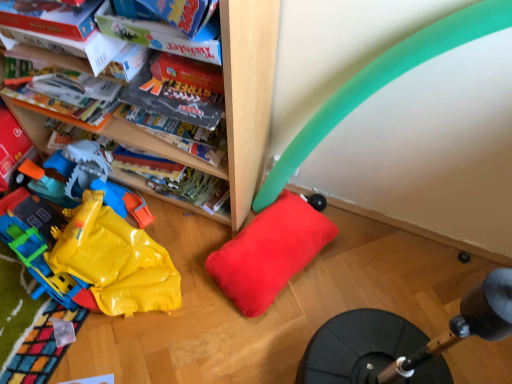
Question: Is yellow plastic bag at lower left behind matte cardboard book at upper left?

Choices:
 (A) yes
 (B) no

Answer: (A)

Question: Are yellow plastic bag at lower left and matte cardboard book at upper left beside each other?

Choices:
 (A) no
 (B) yes

Answer: (A)

Question: From a real-world perspective, is yellow plastic bag at lower left located beneath matte cardboard book at upper left?

Choices:
 (A) no
 (B) yes

Answer: (B)

Question: From the image's perspective, is yellow plastic bag at lower left under matte cardboard book at upper left?

Choices:
 (A) yes
 (B) no

Answer: (A)

Question: Is yellow plastic bag at lower left not within matte cardboard book at upper left?

Choices:
 (A) yes
 (B) no

Answer: (A)

Question: Is yellow plastic bag at lower left not near matte cardboard book at upper left?

Choices:
 (A) no
 (B) yes

Answer: (A)

Question: From the image's perspective, is soft red pillow at center located above yellow plastic bag at lower left?

Choices:
 (A) yes
 (B) no

Answer: (B)

Question: Would you consider soft red pillow at center to be distant from yellow plastic bag at lower left?

Choices:
 (A) yes
 (B) no

Answer: (B)

Question: From a real-world perspective, is soft red pillow at center located beneath yellow plastic bag at lower left?

Choices:
 (A) yes
 (B) no

Answer: (A)

Question: From the image's perspective, does soft red pillow at center appear lower than yellow plastic bag at lower left?

Choices:
 (A) no
 (B) yes

Answer: (B)

Question: Is the depth of soft red pillow at center greater than that of yellow plastic bag at lower left?

Choices:
 (A) yes
 (B) no

Answer: (A)

Question: From a real-world perspective, is soft red pillow at center positioned over yellow plastic bag at lower left based on gravity?

Choices:
 (A) yes
 (B) no

Answer: (B)

Question: Can you confirm if yellow plastic bag at lower left is taller than soft red pillow at center?

Choices:
 (A) no
 (B) yes

Answer: (B)